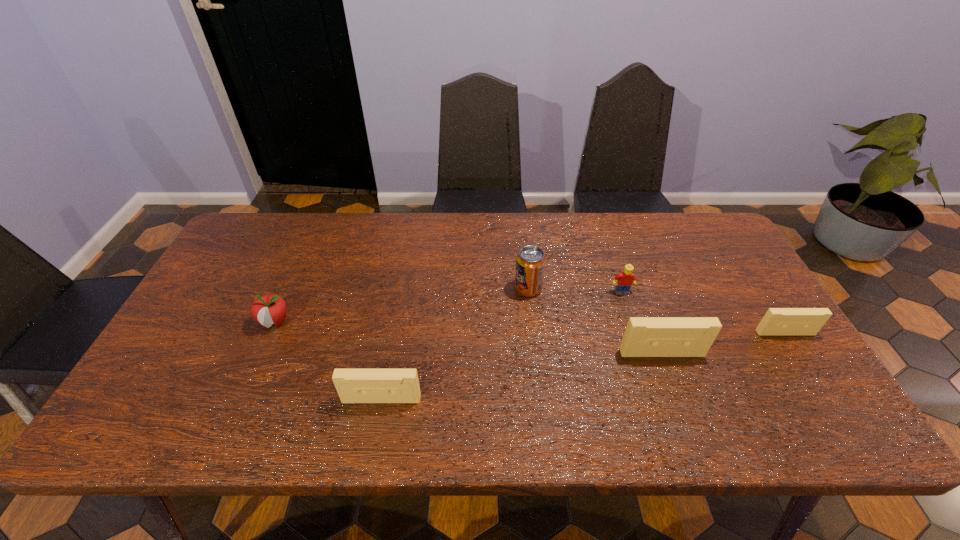
The height and width of the screenshot is (540, 960). In the image, there is a desktop. Identify the location of vacant space at the far right corner. (715, 246).

The height and width of the screenshot is (540, 960). I want to click on free area in between the apple and the second videotape from right to left, so click(468, 338).

The width and height of the screenshot is (960, 540). In order to click on free space that is in between the second nearest object and the third object from left to right in this screenshot , I will do `click(595, 321)`.

Locate an element on the screen. Image resolution: width=960 pixels, height=540 pixels. vacant space that's between the soda can and the second videotape from right to left is located at coordinates tap(595, 321).

Locate an element on the screen. The image size is (960, 540). vacant region between the second tallest videotape and the second videotape from right to left is located at coordinates (521, 376).

What are the coordinates of `free space between the fourth object from right to left and the Lego` in the screenshot? It's located at (575, 291).

Locate an element on the screen. The height and width of the screenshot is (540, 960). vacant space that is in between the second tallest videotape and the Lego is located at coordinates (501, 346).

Locate an element on the screen. This screenshot has height=540, width=960. empty location between the shortest object and the second tallest videotape is located at coordinates (584, 366).

Locate an element on the screen. This screenshot has height=540, width=960. free point between the Lego and the leftmost object is located at coordinates (448, 307).

Identify the location of free spot between the soda can and the Lego. This screenshot has width=960, height=540. (575, 291).